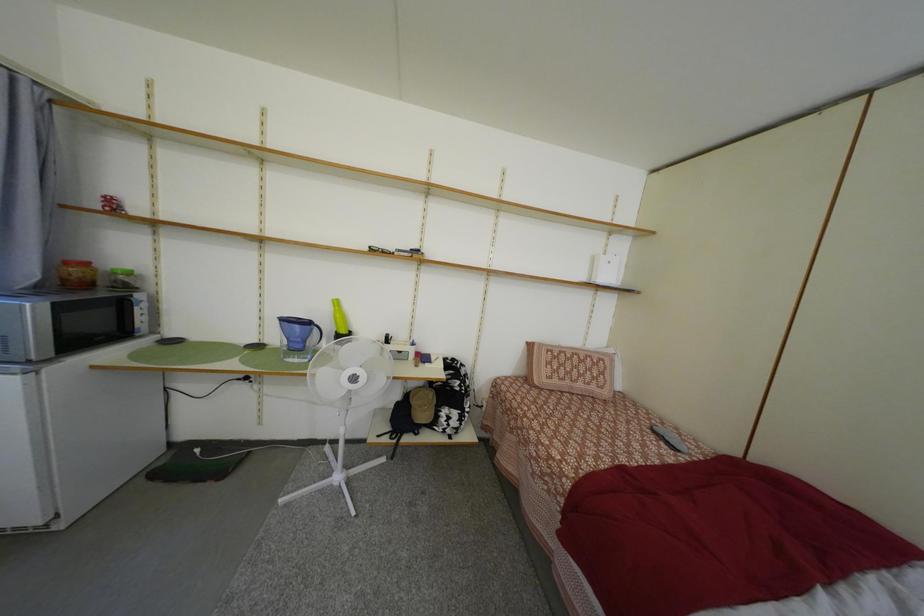
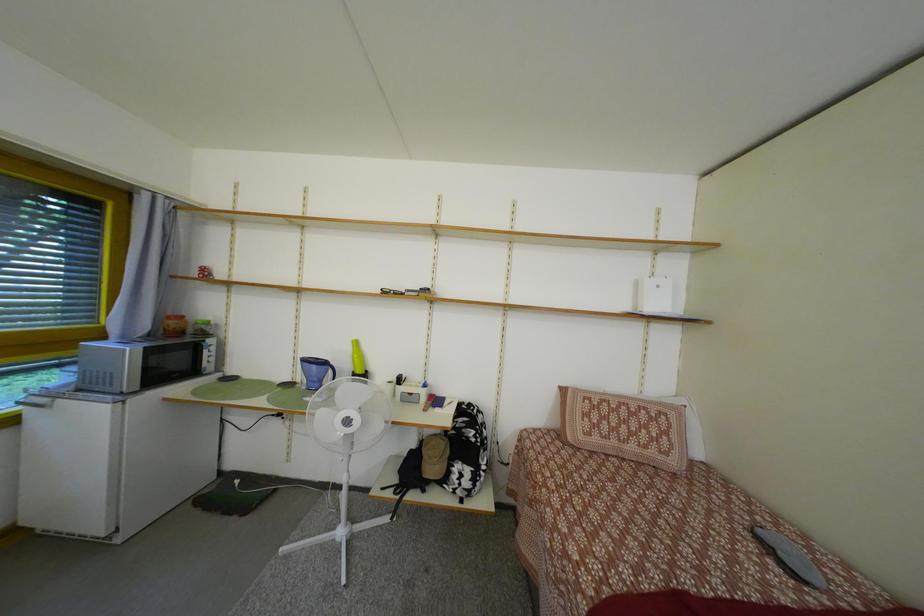
Question: Based on the continuous images, in which direction is the camera rotating? Reply with the corresponding letter.

Choices:
 (A) Left
 (B) Right
 (C) Up
 (D) Down

Answer: (A)